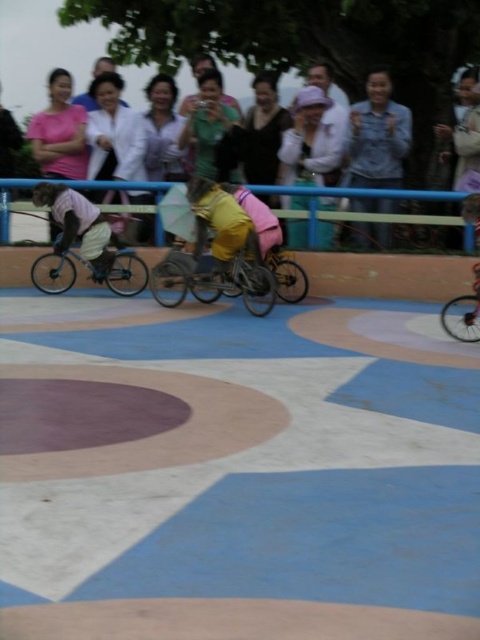
You are standing in the playground and see two points marked on the ground. The first point is at coordinates point [122,292] and the second is at point [455,314]. Which point is closer to you?

Point [122,292] is closer to you because it is further to the viewer than point [455,314].

You are a photographer standing at the edge of the playground. You want to take a photo that includes both the matte yellow pants at center and the white shirt at upper center. Which object should you focus on first to ensure both are in the frame?

The matte yellow pants at center is below white shirt at upper center, so you should focus on the white shirt at upper center first to ensure both are in the frame.